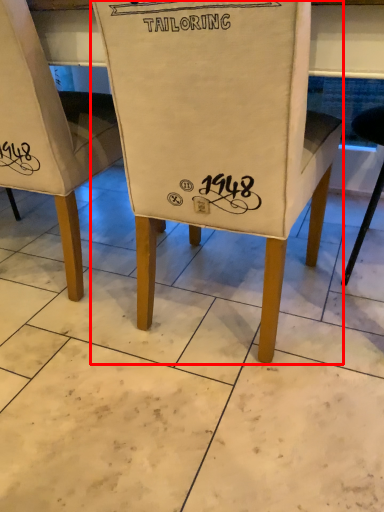
Question: Where is chair (annotated by the red box) located in relation to chair in the image?

Choices:
 (A) right
 (B) left

Answer: (A)